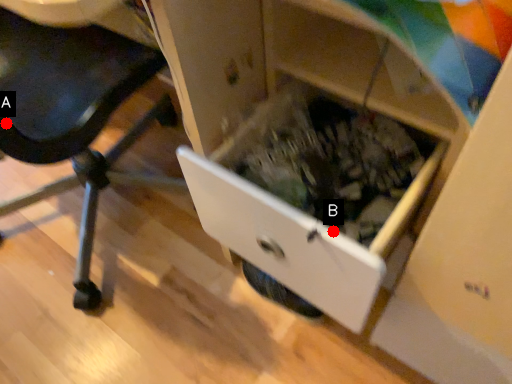
Question: Two points are circled on the image, labeled by A and B beside each circle. Which point is farther to the camera?

Choices:
 (A) A is further
 (B) B is further

Answer: (A)